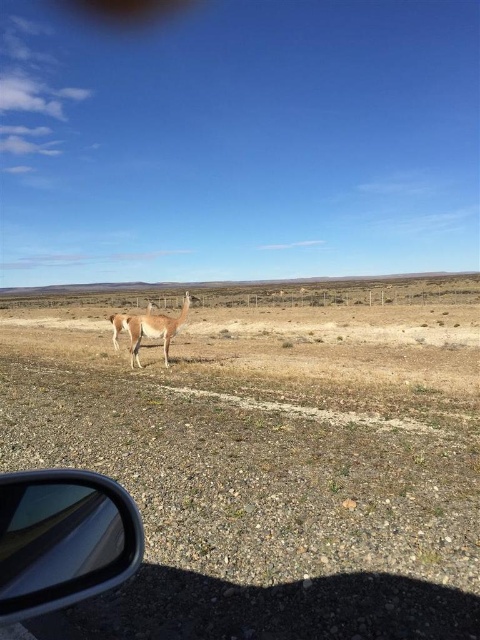
You are driving a car and notice the transparent plastic side mirror at lower left and the light brown fur at center in your view. Which object appears narrower in your field of view?

The transparent plastic side mirror at lower left appears narrower than the light brown fur at center because it is thinner.

You are a photographer trying to capture both the light brown fur at center and the fuzzy brown alpaca at center in the same frame. Which one should you focus on first if you want to ensure both are in focus?

The light brown fur at center is taller than the fuzzy brown alpaca at center, so focusing on the light brown fur at center first will help ensure both are in focus since it is farther away.